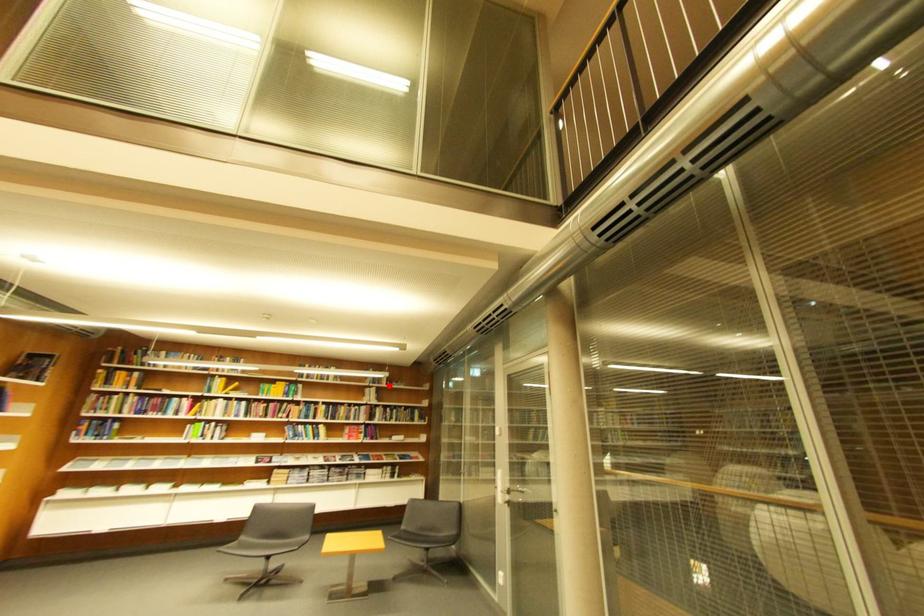
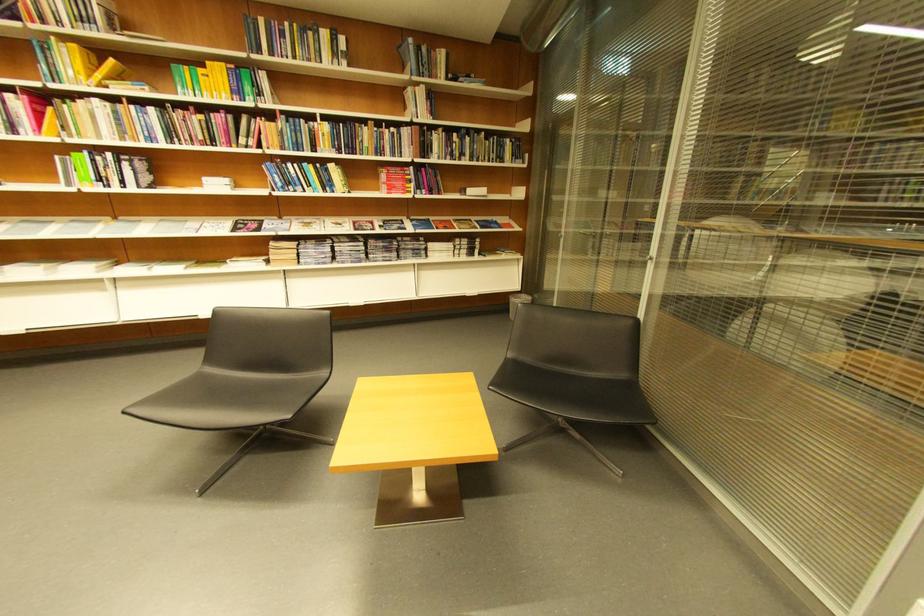
Locate, in the second image, the point that corresponds to the highlighted location in the first image.

(441, 78)